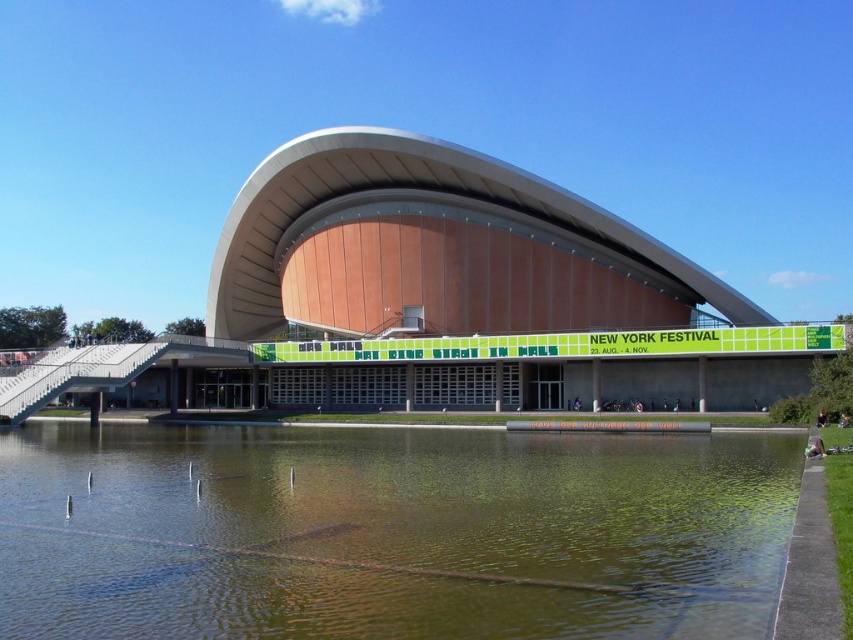
You are standing in front of the matte orange building at center and want to see the greenish water at lower center. Which direction should you move to get a clear view of it?

The greenish water at lower center is in front of the matte orange building at center, so you should move forward towards the direction of the greenish water at lower center to get a clear view.

You are a photographer planning to capture the matte orange building at center and the greenish water at lower center in a single frame. Based on their sizes, which object should you focus on to ensure both are clearly visible in your composition?

The greenish water at lower center is smaller than the matte orange building at center, so focusing on the matte orange building at center will help ensure both objects are clearly visible in the composition.